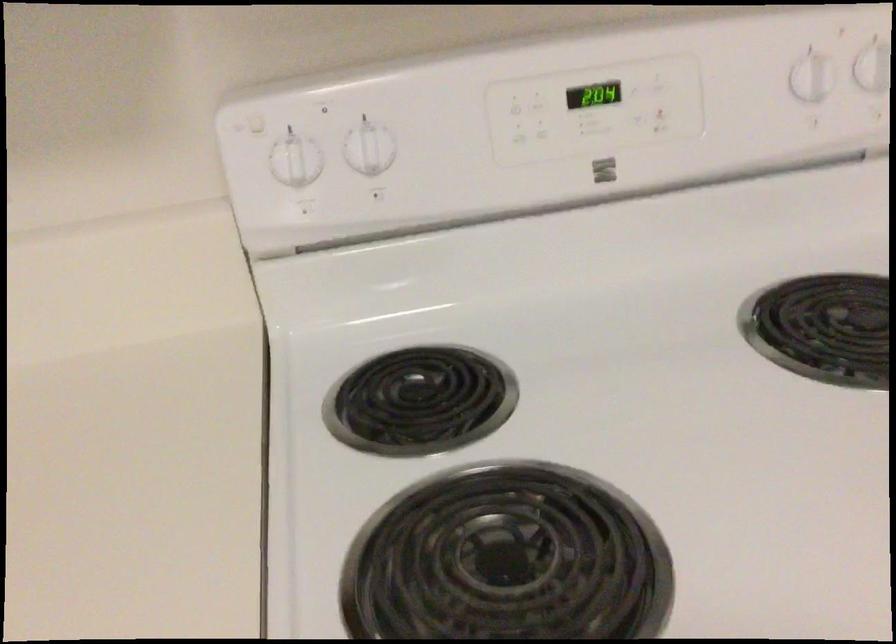
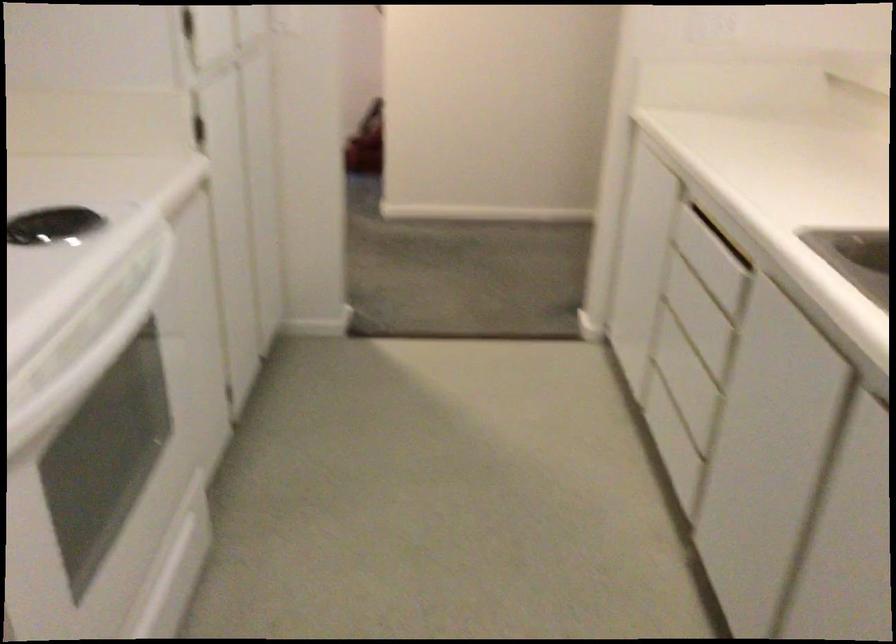
Question: The images are taken continuously from a first-person perspective. In which direction is your viewpoint rotating?

Choices:
 (A) Left
 (B) Right
 (C) Up
 (D) Down

Answer: (B)